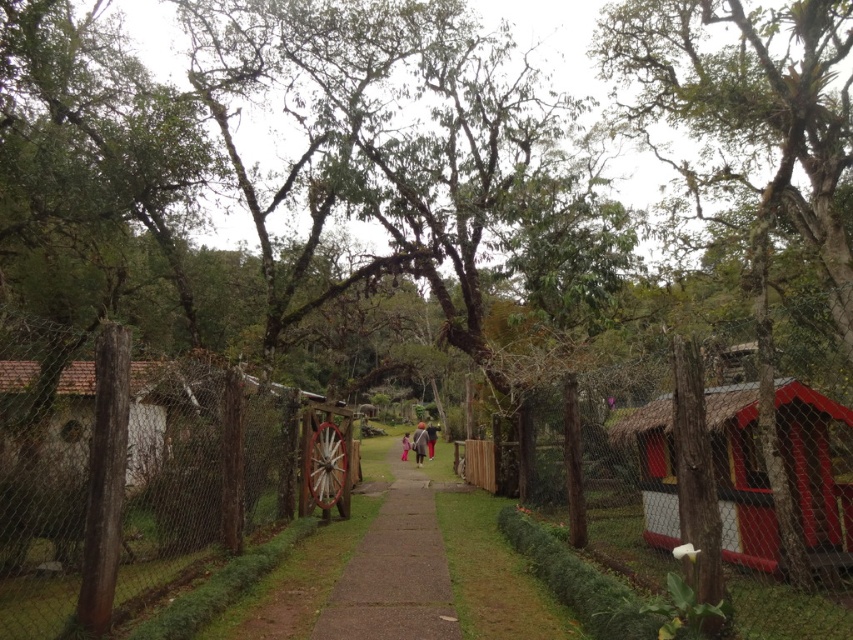
Question: Based on their relative distances, which object is farther from the white wood hut at left?

Choices:
 (A) brown concrete path at center
 (B) wire mesh fence at center
 (C) wooden fence at center
 (D) light pink fabric at center

Answer: (D)

Question: Is red painted wood hut at right smaller than light pink fabric at center?

Choices:
 (A) no
 (B) yes

Answer: (B)

Question: Which object appears farthest from the camera in this image?

Choices:
 (A) red painted wood hut at right
 (B) dark gray fabric jacket at center
 (C) white wood hut at left
 (D) brown concrete path at center

Answer: (B)

Question: Considering the relative positions of red painted wood hut at right and light pink fabric at center in the image provided, where is red painted wood hut at right located with respect to light pink fabric at center?

Choices:
 (A) below
 (B) above

Answer: (B)

Question: Which of the following is the closest to the observer?

Choices:
 (A) matte pink coat at center
 (B) wire mesh fence at center

Answer: (B)

Question: Is brown concrete path at center closer to camera compared to dark gray fabric jacket at center?

Choices:
 (A) yes
 (B) no

Answer: (A)